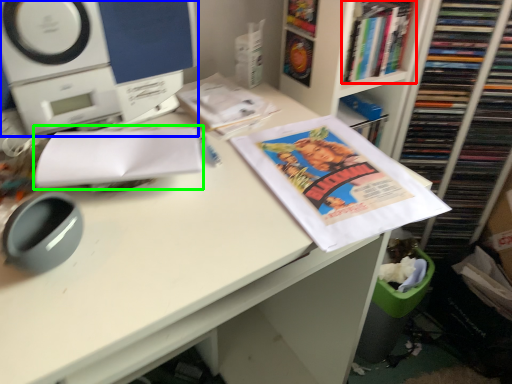
Question: Considering the real-world distances, which object is farthest from book (highlighted by a red box)? home appliance (highlighted by a blue box) or paperback book (highlighted by a green box)?

Choices:
 (A) home appliance
 (B) paperback book

Answer: (B)